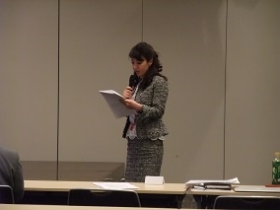
I want to click on table, so click(x=58, y=186).